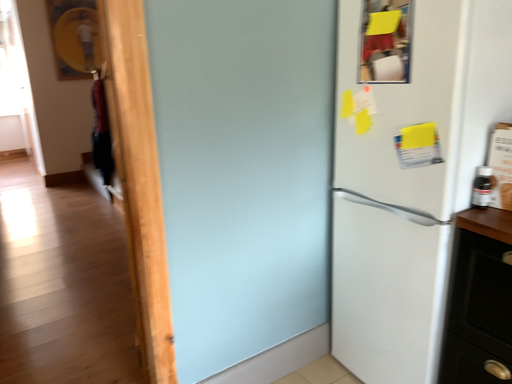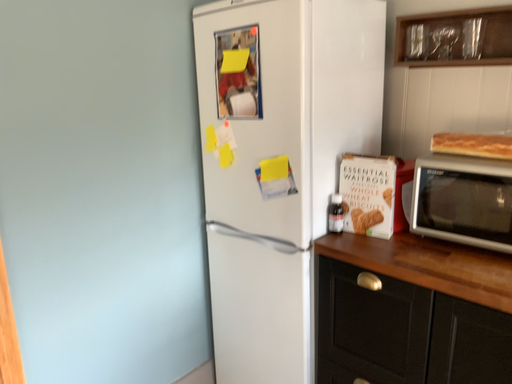
Question: Which way did the camera rotate in the video?

Choices:
 (A) rotated right
 (B) rotated left

Answer: (A)